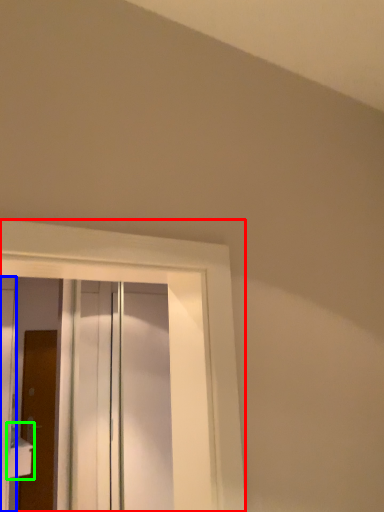
Question: Which is nearer to the window (highlighted by a red box)? door (highlighted by a blue box) or sink (highlighted by a green box).

Choices:
 (A) door
 (B) sink

Answer: (A)